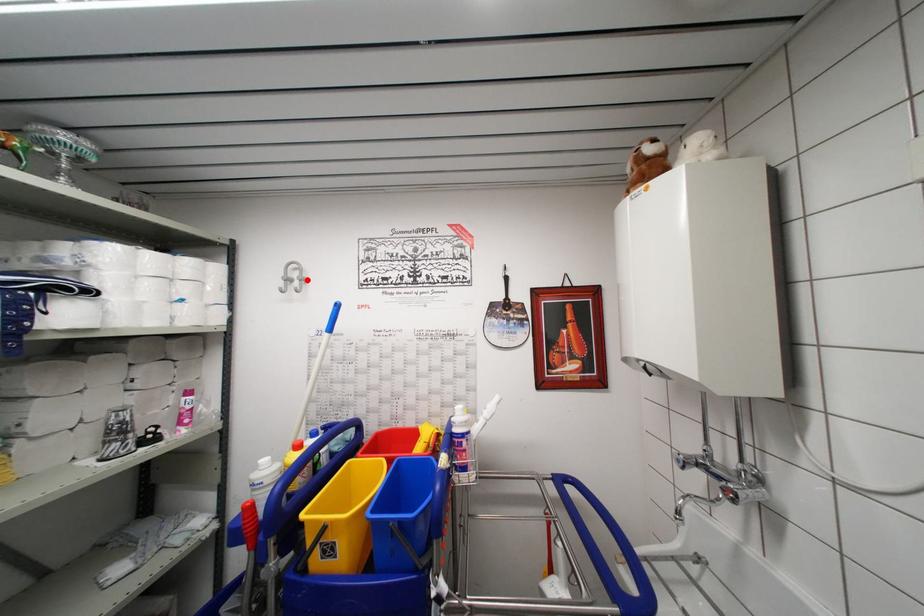
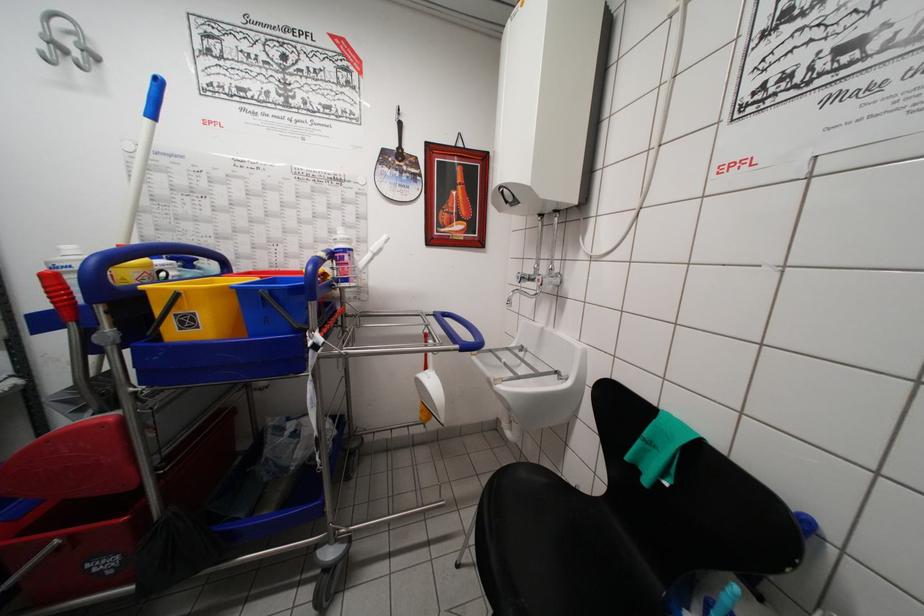
Where in the second image is the point corresponding to the highlighted location from the first image?

(92, 51)